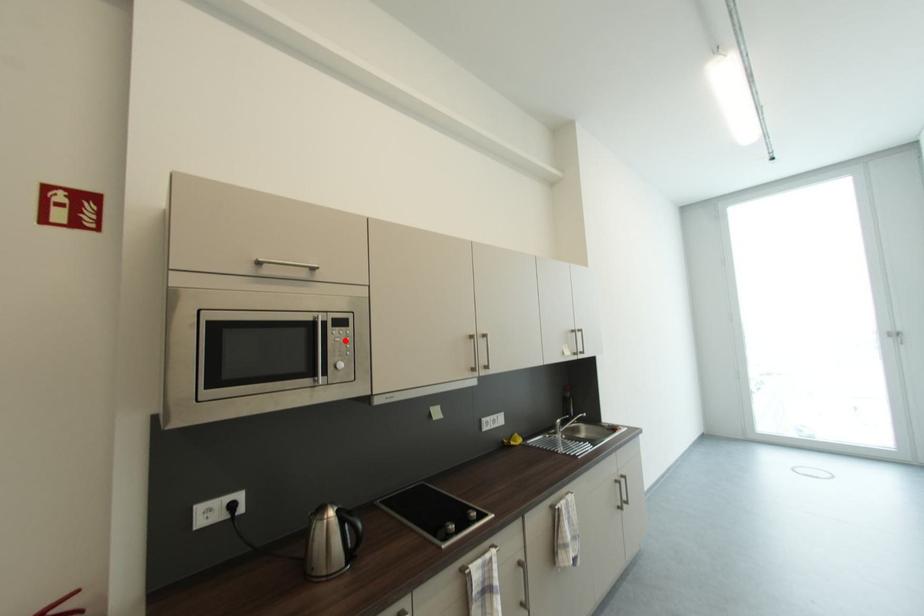
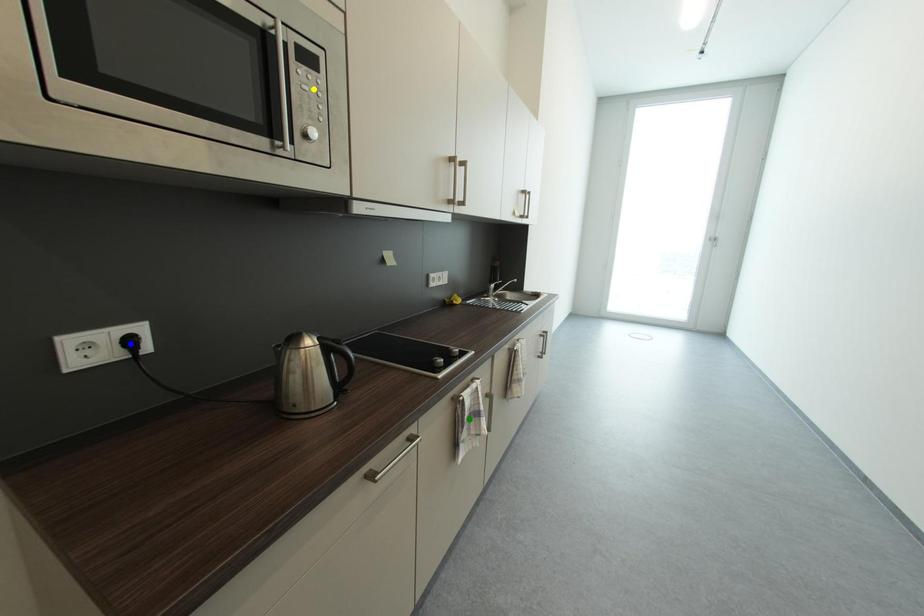
Question: I am providing you with two images of the same scene from different viewpoints. A red point is marked on the first image. You are given multiple points on the second image. Which mark in image 2 goes with the point in image 1?

Choices:
 (A) blue point
 (B) green point
 (C) yellow point

Answer: (C)